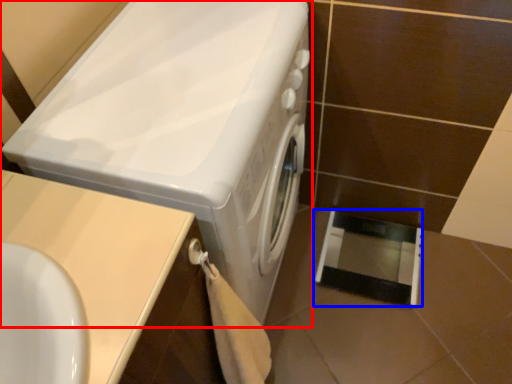
Question: Which object appears farthest to the camera in this image, washing machine (highlighted by a red box) or screen door (highlighted by a blue box)?

Choices:
 (A) washing machine
 (B) screen door

Answer: (B)